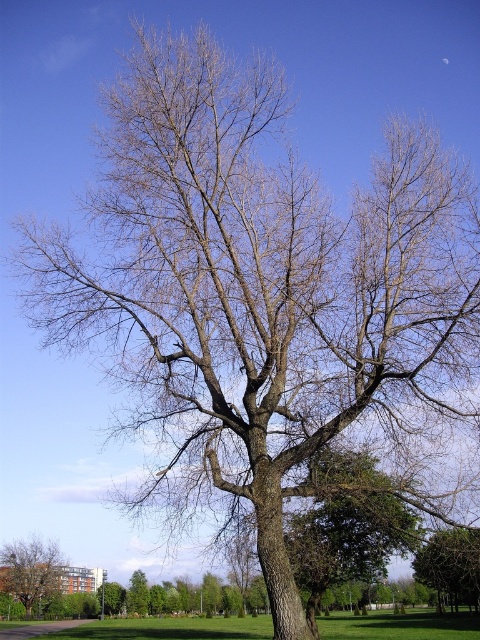
You are standing in the park and see the green grass at center and the brown rough tree at center. Which object is located to the right side of the other?

The green grass at center is to the right of the brown rough tree at center.